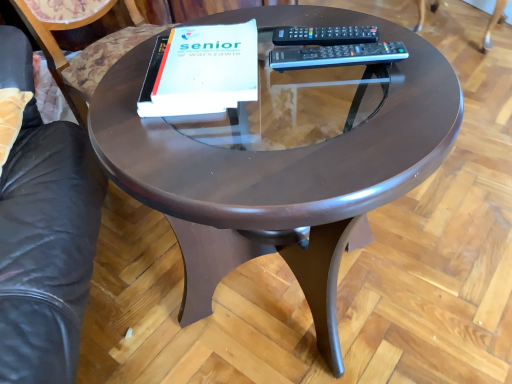
Question: In terms of size, does black plastic remote at upper right, the first remote in the top-to-bottom sequence, appear bigger or smaller than white matte paper at center?

Choices:
 (A) small
 (B) big

Answer: (A)

Question: In terms of height, does black plastic remote at upper right, the first remote from the back, look taller or shorter compared to white matte paper at center?

Choices:
 (A) tall
 (B) short

Answer: (B)

Question: Estimate the real-world distances between objects in this image. Which object is farther from the black plastic remote at upper right, the first remote from the back?

Choices:
 (A) wooden swivel chair at upper right
 (B) white matte paper at center
 (C) shiny brown table at center
 (D) black plastic remote at upper right, the 2th remote when ordered from top to bottom

Answer: (A)

Question: Which is nearer to the wooden swivel chair at upper right?

Choices:
 (A) shiny brown table at center
 (B) white matte paper at center
 (C) black plastic remote at upper right, the first remote from the back
 (D) black plastic remote at upper right, the first remote when ordered from front to back

Answer: (C)